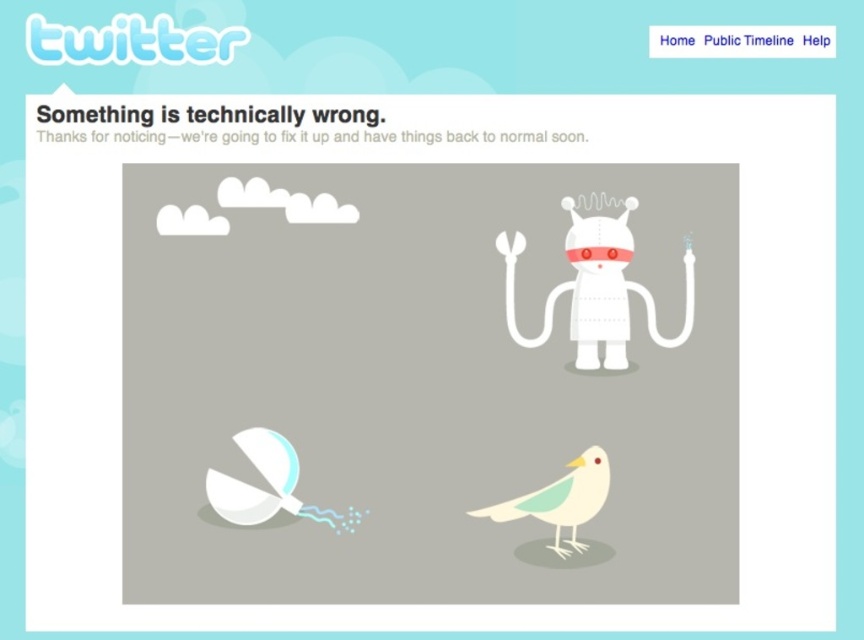
Question: Which point is farther to the camera?

Choices:
 (A) (510, 502)
 (B) (507, 243)

Answer: (B)

Question: From the image, what is the correct spatial relationship of white matte robot at center in relation to white matte bird at center?

Choices:
 (A) left
 (B) right

Answer: (B)

Question: Which point is closer to the camera?

Choices:
 (A) (575, 326)
 (B) (592, 454)

Answer: (B)

Question: Does white matte robot at center appear on the left side of white matte bird at center?

Choices:
 (A) yes
 (B) no

Answer: (B)

Question: Considering the relative positions of white matte robot at center and white matte bird at center in the image provided, where is white matte robot at center located with respect to white matte bird at center?

Choices:
 (A) left
 (B) right

Answer: (B)